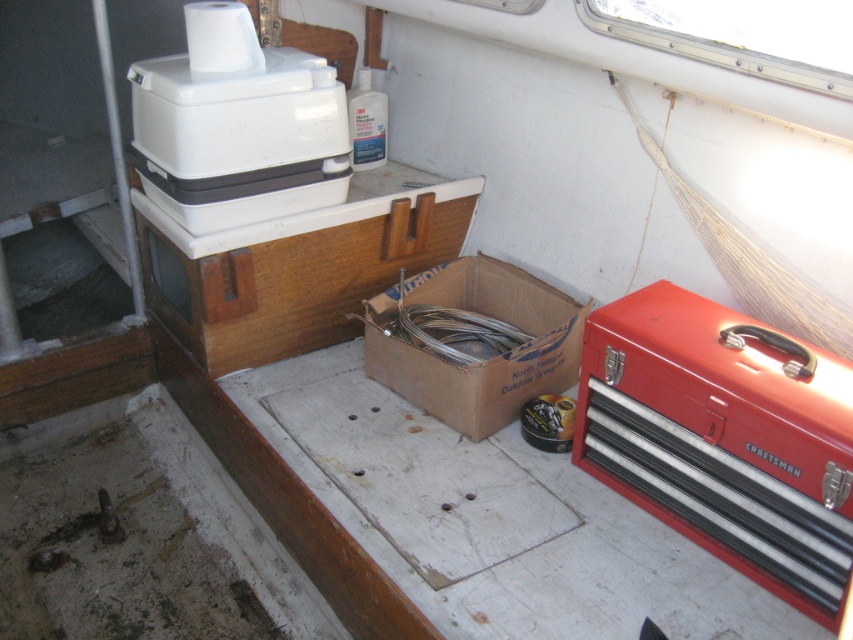
You are standing in the boat corner and want to place a new tool box. The white plastic cooler at upper left is currently occupying space at point 0.197, 0.279. Can you place the tool box at point 0.2, 0.28?

The white plastic cooler at upper left is located at point (236, 125), so placing the tool box at point (238, 128) would be very close but technically possible since the coordinates are slightly different.

You are organizing the items in the boat corner. You have the red metal toolbox at right and the brown cardboard box at center. Which object is located to the right of the other?

The red metal toolbox at right is positioned on the right side of brown cardboard box at center.

From the picture: You are a sailor on a boat and need to access both the red metal toolbox at right and the white plastic cooler at upper left. Which object is positioned lower in the boat cabin?

The red metal toolbox at right is located below the white plastic cooler at upper left, so it is positioned lower in the boat cabin.